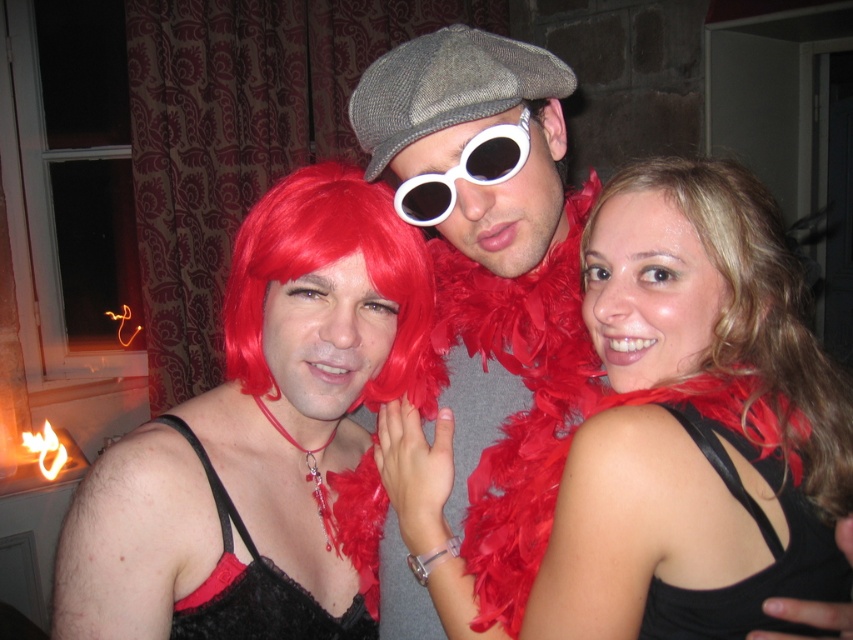
Looking at this image, you are at a costume party and see the shiny red wig at center and the white matte goggles at center. Which item is located lower on the person?

The shiny red wig at center is positioned under white matte goggles at center, so the shiny red wig at center is located lower on the person.

You are a photographer at the event and want to focus on the shiny red wig at center and the textured gray cap at center. Which one is closer to you?

The shiny red wig at center is closer to you than the textured gray cap at center.